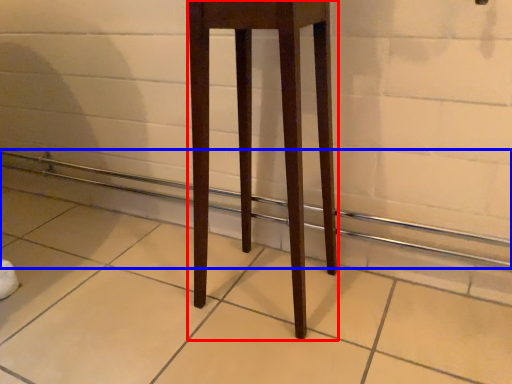
Question: Which point is closer to the camera, furniture (highlighted by a red box) or balustrade (highlighted by a blue box)?

Choices:
 (A) furniture
 (B) balustrade

Answer: (A)